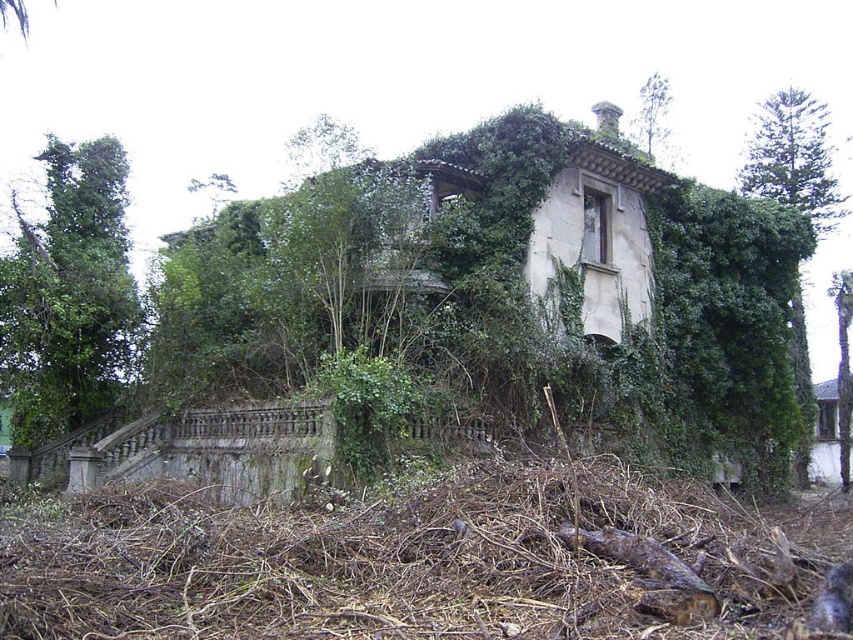
Question: Which point is closer to the camera taking this photo?

Choices:
 (A) (109, 381)
 (B) (642, 104)
 (C) (804, 387)
 (D) (721, 621)

Answer: (D)

Question: Is the position of brown wood debris at lower center more distant than that of green leafy tree at right?

Choices:
 (A) no
 (B) yes

Answer: (A)

Question: Is green leafy tree at left thinner than green leafy tree at upper center?

Choices:
 (A) no
 (B) yes

Answer: (B)

Question: Is green leafy tree at left to the right of green leafy tree at right from the viewer's perspective?

Choices:
 (A) yes
 (B) no

Answer: (B)

Question: Estimate the real-world distances between objects in this image. Which object is farther from the green leafy tree at left?

Choices:
 (A) green leafy tree at right
 (B) brown wood debris at lower center
 (C) green leafy tree at upper center

Answer: (A)

Question: Among these points, which one is nearest to the camera?

Choices:
 (A) (71, 264)
 (B) (842, 368)

Answer: (A)